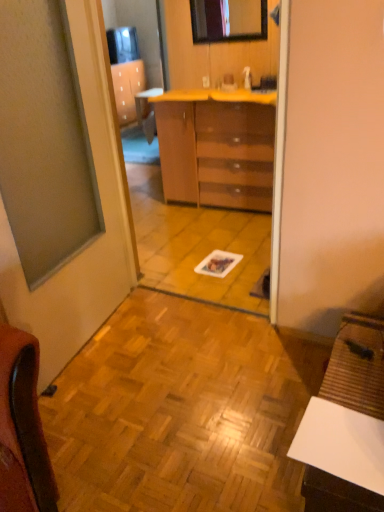
Question: Is the depth of matte glass window at left greater than that of glossy brown chest of drawers at center?

Choices:
 (A) yes
 (B) no

Answer: (B)

Question: Is matte glass window at left in contact with glossy brown chest of drawers at center?

Choices:
 (A) no
 (B) yes

Answer: (A)

Question: Does matte glass window at left have a greater height compared to glossy brown chest of drawers at center?

Choices:
 (A) yes
 (B) no

Answer: (A)

Question: Is glossy brown chest of drawers at center a part of matte glass window at left?

Choices:
 (A) no
 (B) yes

Answer: (A)

Question: Does matte glass window at left appear on the left side of glossy brown chest of drawers at center?

Choices:
 (A) yes
 (B) no

Answer: (A)

Question: From a real-world perspective, is white matte desk at lower right physically located above or below glossy brown chest of drawers at center?

Choices:
 (A) above
 (B) below

Answer: (B)

Question: Considering the relative positions of white matte desk at lower right and glossy brown chest of drawers at center in the image provided, is white matte desk at lower right to the left or to the right of glossy brown chest of drawers at center?

Choices:
 (A) left
 (B) right

Answer: (B)

Question: From the image's perspective, is white matte desk at lower right positioned above or below glossy brown chest of drawers at center?

Choices:
 (A) below
 (B) above

Answer: (A)

Question: Considering the positions of white matte desk at lower right and glossy brown chest of drawers at center in the image, is white matte desk at lower right wider or thinner than glossy brown chest of drawers at center?

Choices:
 (A) wide
 (B) thin

Answer: (A)

Question: Looking at their shapes, would you say matte glass window at left is wider or thinner than white matte desk at lower right?

Choices:
 (A) thin
 (B) wide

Answer: (A)

Question: From the image's perspective, is matte glass window at left located above or below white matte desk at lower right?

Choices:
 (A) above
 (B) below

Answer: (A)

Question: Looking at the image, does matte glass window at left seem bigger or smaller compared to white matte desk at lower right?

Choices:
 (A) small
 (B) big

Answer: (B)

Question: From a real-world perspective, is matte glass window at left positioned above or below white matte desk at lower right?

Choices:
 (A) below
 (B) above

Answer: (B)

Question: Is matte glass window at left bigger or smaller than yellow laminate counter at center?

Choices:
 (A) small
 (B) big

Answer: (B)

Question: Based on their positions, is matte glass window at left located to the left or right of yellow laminate counter at center?

Choices:
 (A) left
 (B) right

Answer: (A)